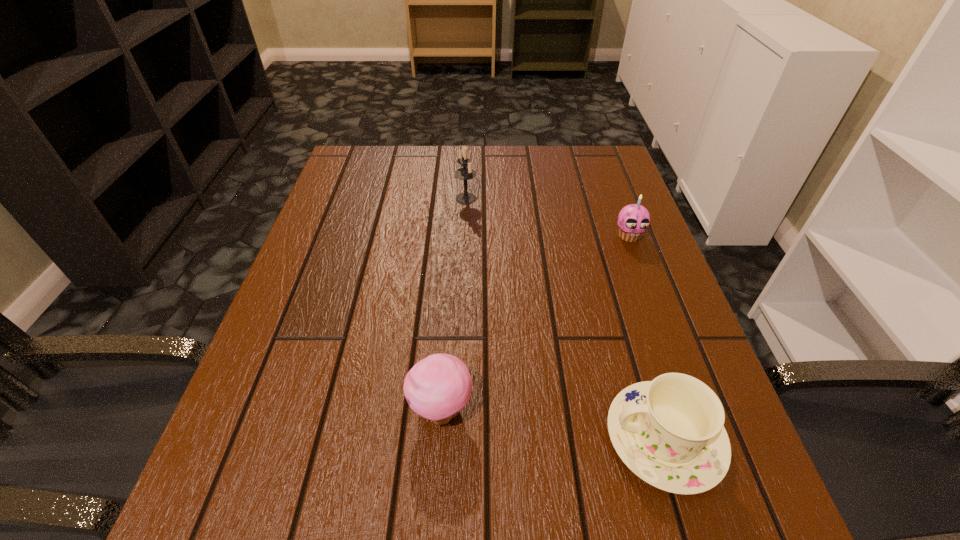
Locate an element on the screen. vacant position located on the handle side of the chinaware is located at coordinates (408, 438).

This screenshot has width=960, height=540. I want to click on vacant space located 0.400m on the handle side of the chinaware, so click(342, 438).

Locate an element on the screen. The image size is (960, 540). object at the far edge is located at coordinates (464, 173).

In order to click on object at the near edge in this screenshot , I will do [x=670, y=432].

Image resolution: width=960 pixels, height=540 pixels. I want to click on cupcake at the right edge, so click(x=634, y=219).

Locate an element on the screen. chinaware that is at the right edge is located at coordinates (670, 432).

At what (x,y) coordinates should I click in order to perform the action: click on object that is positioned at the near right corner. Please return your answer as a coordinate pair (x, y). The image size is (960, 540). Looking at the image, I should click on (670, 432).

Locate an element on the screen. Image resolution: width=960 pixels, height=540 pixels. vacant space at the far edge of the desktop is located at coordinates (411, 149).

You are a GUI agent. You are given a task and a screenshot of the screen. Output one action in this format:
    pyautogui.click(x=<x>, y=<y>)
    Task: Click on the vacant space at the left edge of the desktop
    Image resolution: width=960 pixels, height=540 pixels.
    Given the screenshot: What is the action you would take?
    pyautogui.click(x=290, y=468)

Identify the location of vacant area at the right edge. This screenshot has width=960, height=540. (623, 252).